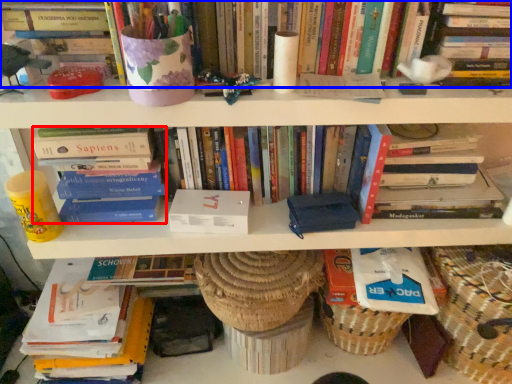
Question: Which point is closer to the camera, book (highlighted by a red box) or book (highlighted by a blue box)?

Choices:
 (A) book
 (B) book

Answer: (B)